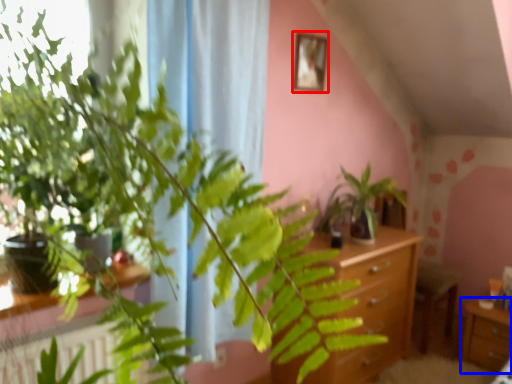
Question: Which object appears closest to the camera in this image, picture frame (highlighted by a red box) or table (highlighted by a blue box)?

Choices:
 (A) picture frame
 (B) table

Answer: (A)